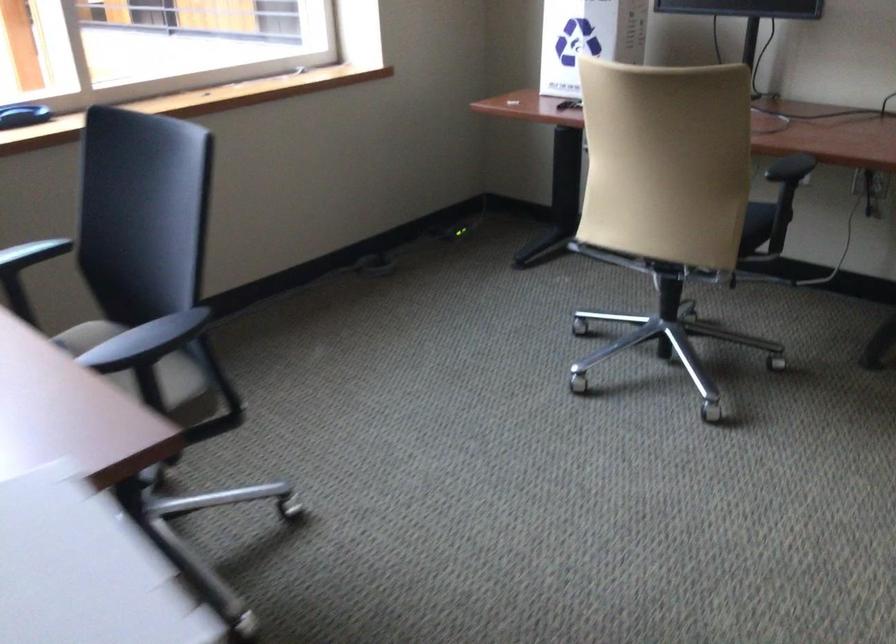
Describe the element at coordinates (150, 373) in the screenshot. This screenshot has height=644, width=896. I see `the black chair sitting surface` at that location.